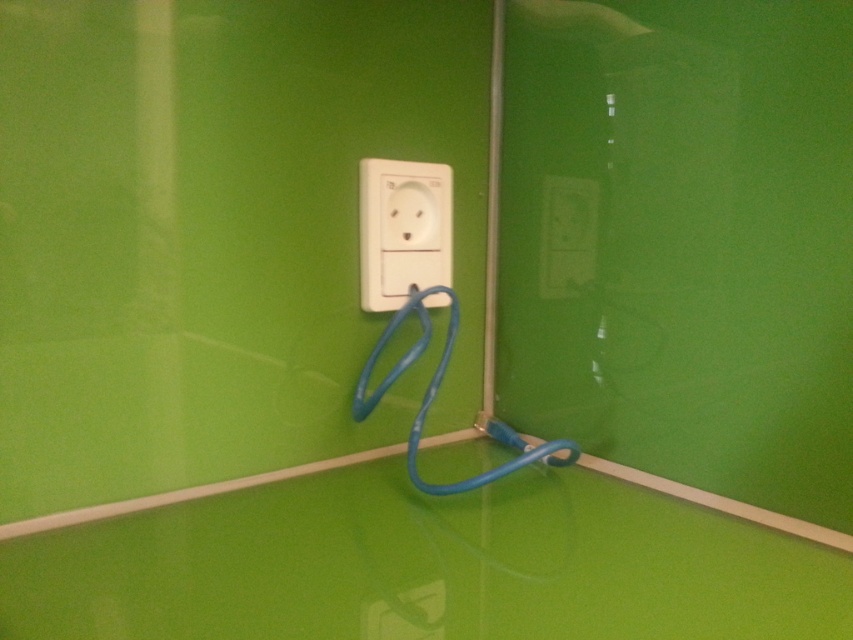
Question: Is white plastic socket at center bigger than white plastic outlet at upper center?

Choices:
 (A) no
 (B) yes

Answer: (B)

Question: Can you confirm if white plastic socket at center is bigger than white plastic outlet at lower center?

Choices:
 (A) yes
 (B) no

Answer: (A)

Question: Does white plastic socket at center appear on the right side of white plastic outlet at lower center?

Choices:
 (A) yes
 (B) no

Answer: (B)

Question: Which of the following is the farthest from the observer?

Choices:
 (A) white plastic outlet at lower center
 (B) white plastic outlet at upper center

Answer: (B)

Question: Which object is positioned closest to the white plastic outlet at lower center?

Choices:
 (A) white plastic outlet at upper center
 (B) white plastic socket at center

Answer: (B)

Question: Which object is positioned closest to the white plastic outlet at lower center?

Choices:
 (A) white plastic outlet at upper center
 (B) white plastic socket at center

Answer: (B)